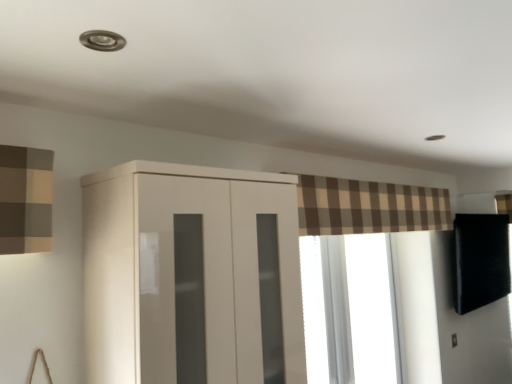
What is the approximate width of glossy white cupboard at center?

13.64 inches.

Describe the element at coordinates (368, 207) in the screenshot. This screenshot has width=512, height=384. I see `brown plaid curtain at upper center` at that location.

At what (x,y) coordinates should I click in order to perform the action: click on glossy white cupboard at center. Please return your answer as a coordinate pair (x, y). Looking at the image, I should click on (192, 276).

Looking at this image, which is more to the right, brown plaid curtain at upper center or glossy white cupboard at center?

From the viewer's perspective, brown plaid curtain at upper center appears more on the right side.

Is brown plaid curtain at upper center in contact with glossy white cupboard at center?

There is a gap between brown plaid curtain at upper center and glossy white cupboard at center.

Find the location of a particular element. cupboard in front of the brown plaid curtain at upper center is located at coordinates point(192,276).

From the picture: How different are the orientations of brown plaid curtain at upper center and glossy white cupboard at center in degrees?

0.000378 degrees.

Which is in front, point (365, 199) or point (307, 259)?

The point (365, 199) is in front.

From the image's perspective, is brown plaid curtain at upper center above or below transparent glass window at center?

brown plaid curtain at upper center is situated higher than transparent glass window at center in the image.

From the picture: Based on their sizes in the image, would you say brown plaid curtain at upper center is bigger or smaller than transparent glass window at center?

brown plaid curtain at upper center is bigger than transparent glass window at center.

Is brown plaid curtain at upper center facing away from transparent glass window at center?

No, brown plaid curtain at upper center's orientation is not away from transparent glass window at center.

Could you tell me if transparent glass window at center is facing glossy white cupboard at center?

No, transparent glass window at center is not oriented towards glossy white cupboard at center.

In the scene shown: From the image's perspective, would you say transparent glass window at center is positioned over glossy white cupboard at center?

No.

Looking at the image, does transparent glass window at center seem bigger or smaller compared to glossy white cupboard at center?

transparent glass window at center is smaller than glossy white cupboard at center.

Between transparent glass window at center and glossy white cupboard at center, which one has smaller width?

transparent glass window at center is thinner.

Is glossy white cupboard at center bigger than transparent glass window at center?

Indeed, glossy white cupboard at center has a larger size compared to transparent glass window at center.

Does glossy white cupboard at center have a greater height compared to transparent glass window at center?

No.

From a real-world perspective, between glossy white cupboard at center and transparent glass window at center, who is vertically higher?

glossy white cupboard at center, from a real-world perspective.

Can you tell me how much glossy white cupboard at center and transparent glass window at center differ in facing direction?

The angle between the facing direction of glossy white cupboard at center and the facing direction of transparent glass window at center is 0.517 degrees.

Is glossy white cupboard at center touching brown plaid curtain at upper center?

No, glossy white cupboard at center is not making contact with brown plaid curtain at upper center.

From the image's perspective, is glossy white cupboard at center under brown plaid curtain at upper center?

Correct, glossy white cupboard at center appears lower than brown plaid curtain at upper center in the image.

I want to click on cupboard lying below the brown plaid curtain at upper center (from the image's perspective), so click(x=192, y=276).

Considering the positions of objects glossy white cupboard at center and brown plaid curtain at upper center in the image provided, who is in front, glossy white cupboard at center or brown plaid curtain at upper center?

Positioned in front is glossy white cupboard at center.

From a real-world perspective, who is located higher, transparent glass window at center or brown plaid curtain at upper center?

brown plaid curtain at upper center, from a real-world perspective.

Is transparent glass window at center positioned with its back to brown plaid curtain at upper center?

transparent glass window at center is not turned away from brown plaid curtain at upper center.

Which is less distant, (313, 298) or (340, 211)?

The point (340, 211) is closer to the camera.

At what (x,y) coordinates should I click in order to perform the action: click on cupboard that appears below the brown plaid curtain at upper center (from the image's perspective). Please return your answer as a coordinate pair (x, y). This screenshot has height=384, width=512. Looking at the image, I should click on (192, 276).

Identify the location of curtain positioned vertically above the transparent glass window at center (from a real-world perspective). This screenshot has width=512, height=384. (368, 207).

Considering their positions, is brown plaid curtain at upper center positioned closer to glossy white cupboard at center than transparent glass window at center?

Among the two, brown plaid curtain at upper center is located nearer to glossy white cupboard at center.

When comparing their distances from glossy white cupboard at center, does transparent glass window at center or brown plaid curtain at upper center seem further?

The object further to glossy white cupboard at center is transparent glass window at center.

Looking at this image, estimate the real-world distances between objects in this image. Which object is closer to brown plaid curtain at upper center, transparent glass window at center or glossy white cupboard at center?

Based on the image, transparent glass window at center appears to be nearer to brown plaid curtain at upper center.

When comparing their distances from brown plaid curtain at upper center, does glossy white cupboard at center or transparent glass window at center seem further?

glossy white cupboard at center.

Based on their spatial positions, is brown plaid curtain at upper center or glossy white cupboard at center further from transparent glass window at center?

glossy white cupboard at center is further to transparent glass window at center.

Considering their positions, is glossy white cupboard at center positioned further to transparent glass window at center than brown plaid curtain at upper center?

glossy white cupboard at center.

Where is `curtain located between glossy white cupboard at center and transparent glass window at center in the depth direction`? This screenshot has height=384, width=512. curtain located between glossy white cupboard at center and transparent glass window at center in the depth direction is located at coordinates (368, 207).